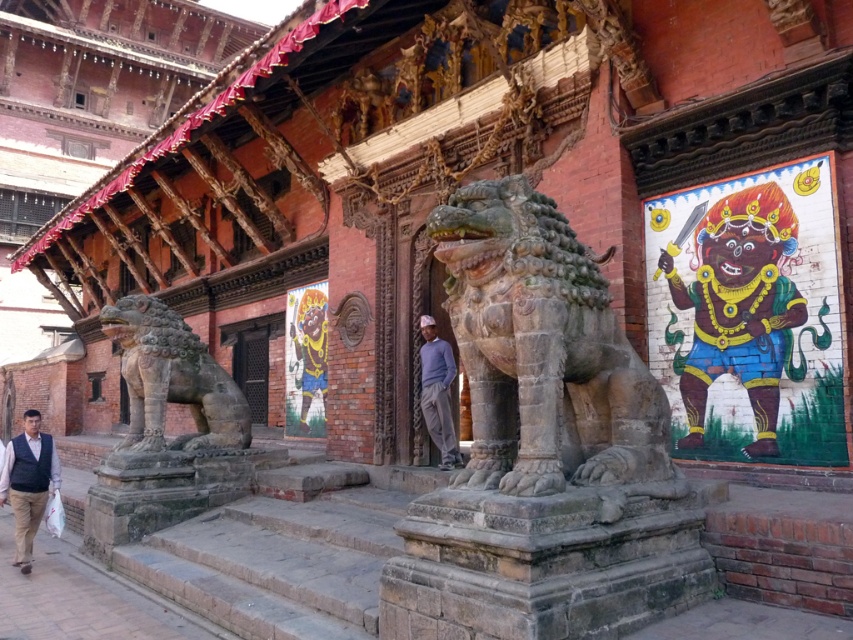
Describe the element at coordinates (544, 355) in the screenshot. The width and height of the screenshot is (853, 640). I see `carved stone lion at center` at that location.

Is carved stone lion at center taller than multicolored painted deity at upper right?

Incorrect, carved stone lion at center's height is not larger of multicolored painted deity at upper right's.

Find the location of `carved stone lion at center`. carved stone lion at center is located at coordinates (544, 355).

Who is more distant from viewer, [734,298] or [447,374]?

The point [447,374] is behind.

Image resolution: width=853 pixels, height=640 pixels. I want to click on multicolored painted deity at upper right, so pos(738,307).

Is multicolored painted deity at upper right to the left of dark blue vest at lower left from the viewer's perspective?

Incorrect, multicolored painted deity at upper right is not on the left side of dark blue vest at lower left.

Does point (795, 305) come in front of point (28, 492)?

Yes, it is.

You are a GUI agent. You are given a task and a screenshot of the screen. Output one action in this format:
    pyautogui.click(x=<x>, y=<y>)
    Task: Click on the multicolored painted deity at upper right
    
    Given the screenshot: What is the action you would take?
    pyautogui.click(x=738, y=307)